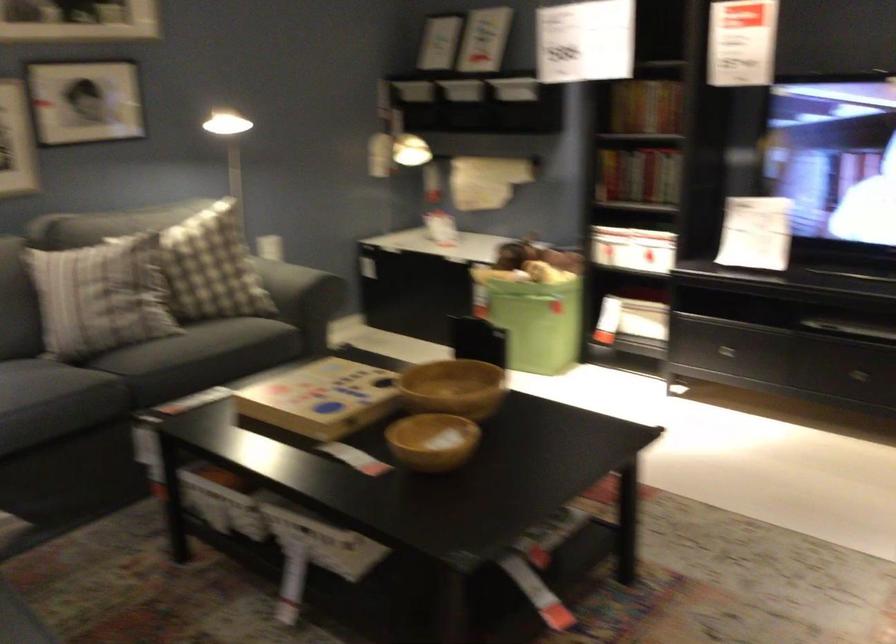
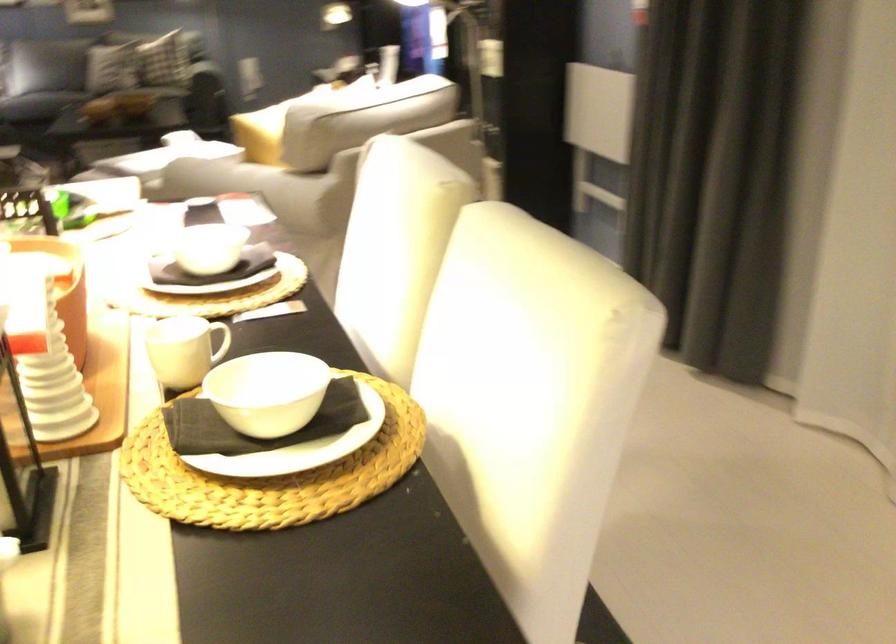
Question: I am providing you with two images of the same scene from different viewpoints. Which of the following objects are not visible in image2?

Choices:
 (A) white mug handle
 (B) yellow bowl
 (C) white bowl
 (D) brown wooden bowl

Answer: (D)